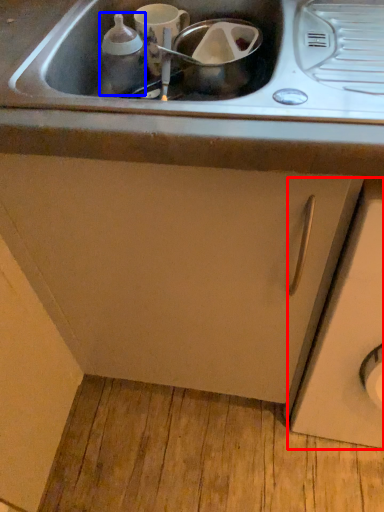
Question: Which point is further to the camera, cabinetry (highlighted by a red box) or bottle (highlighted by a blue box)?

Choices:
 (A) cabinetry
 (B) bottle

Answer: (B)